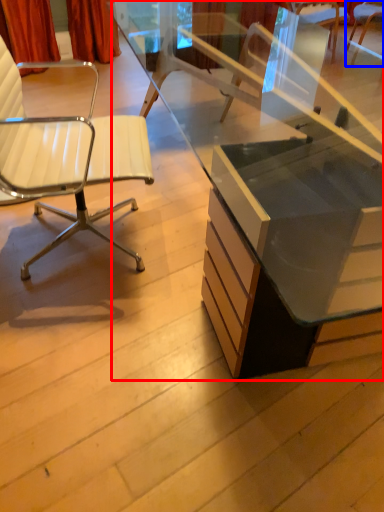
Question: Which of the following is the farthest to the observer, desk (highlighted by a red box) or chair (highlighted by a blue box)?

Choices:
 (A) desk
 (B) chair

Answer: (B)